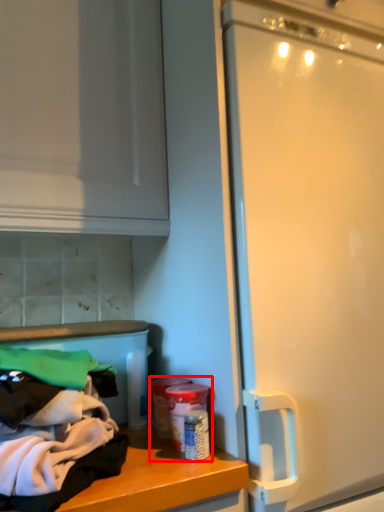
Question: Observing the image, what is the correct spatial positioning of garbage (annotated by the red box) in reference to clothing?

Choices:
 (A) left
 (B) right

Answer: (B)